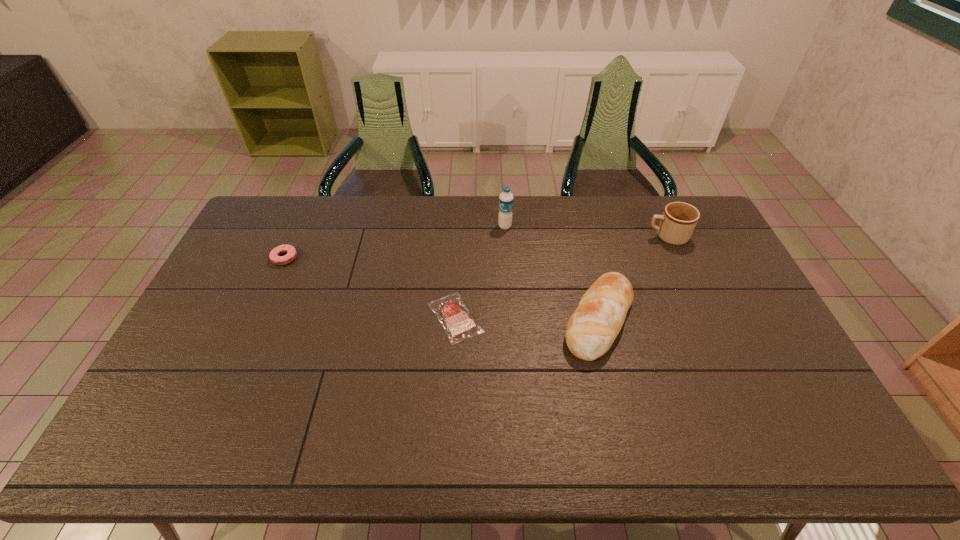
Where is `the third object from right to left`? The image size is (960, 540). the third object from right to left is located at coordinates (506, 198).

Image resolution: width=960 pixels, height=540 pixels. Find the location of `the tallest object`. the tallest object is located at coordinates click(506, 198).

Where is `the rightmost object`? the rightmost object is located at coordinates (679, 219).

You are a GUI agent. You are given a task and a screenshot of the screen. Output one action in this format:
    pyautogui.click(x=<x>, y=<y>)
    Task: Click on the bread
    
    Given the screenshot: What is the action you would take?
    pyautogui.click(x=591, y=330)

In order to click on doughnut in this screenshot , I will do `click(274, 256)`.

Locate an element on the screen. the third nearest object is located at coordinates (274, 256).

I want to click on steak, so click(451, 312).

Identify the location of the second object from left to right. This screenshot has height=540, width=960. (451, 312).

I want to click on vacant space positioned 0.350m on the label of the third object from right to left, so click(x=403, y=226).

This screenshot has width=960, height=540. Find the location of `vacant space positioned 0.090m on the label of the third object from right to left`. vacant space positioned 0.090m on the label of the third object from right to left is located at coordinates (473, 226).